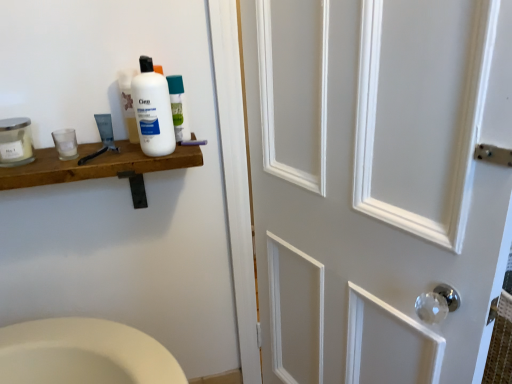
Question: Considering the positions of white plastic bottle at upper left and clear glass jar at left, which is the first mouthwash from left to right, in the image, is white plastic bottle at upper left wider or thinner than clear glass jar at left, which is the first mouthwash from left to right,?

Choices:
 (A) thin
 (B) wide

Answer: (A)

Question: From a real-world perspective, is white plastic bottle at upper left physically located above or below clear glass jar at left, which is the first mouthwash from left to right?

Choices:
 (A) below
 (B) above

Answer: (B)

Question: Which is farther from the clear glass jar at left, which is the first mouthwash from left to right?

Choices:
 (A) white plastic bottle at upper left
 (B) white glossy mouthwash at upper center, which is the first mouthwash in right-to-left order
 (C) white painted wood door at right
 (D) clear glass mouthwash at left, which is the second mouthwash in left-to-right order

Answer: (C)

Question: Which object is positioned closest to the white glossy mouthwash at upper center, which appears as the third mouthwash when viewed from the left?

Choices:
 (A) clear glass jar at left, which is the first mouthwash from left to right
 (B) clear glass mouthwash at left, the second mouthwash viewed from the right
 (C) white plastic bottle at upper left
 (D) white painted wood door at right

Answer: (C)